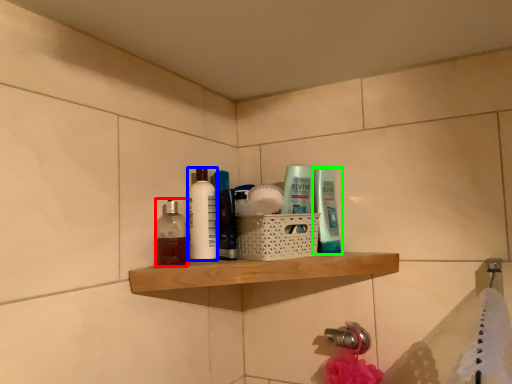
Question: Considering the real-world distances, which object is farthest from mouthwash (highlighted by a red box)? toiletry (highlighted by a blue box) or toiletry (highlighted by a green box)?

Choices:
 (A) toiletry
 (B) toiletry

Answer: (B)